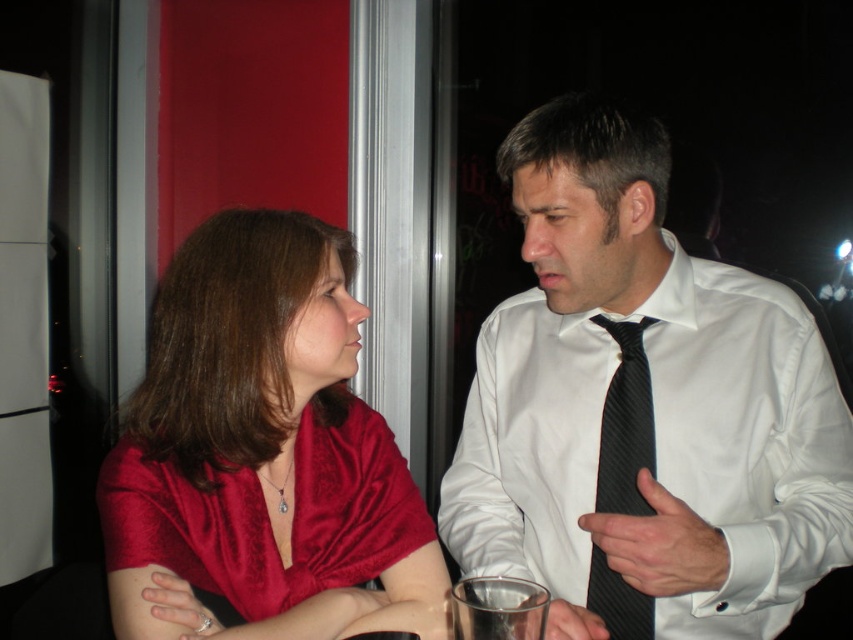
Between point (666, 584) and point (258, 298), which one is positioned behind?

The point (258, 298) is behind.

Can you confirm if white satin shirt at center is positioned above satin red blouse at center?

Correct, white satin shirt at center is located above satin red blouse at center.

Is point (819, 563) positioned after point (383, 589)?

No, it is in front of (383, 589).

I want to click on white satin shirt at center, so click(642, 408).

Describe the element at coordinates (642, 408) in the screenshot. I see `white satin shirt at center` at that location.

Does white satin shirt at center have a lesser height compared to black striped tie at right?

Incorrect, white satin shirt at center's height does not fall short of black striped tie at right's.

Which is in front, point (756, 448) or point (639, 426)?

Positioned in front is point (756, 448).

Identify the location of white satin shirt at center. This screenshot has height=640, width=853. (642, 408).

Can you confirm if black striped tie at right is positioned to the left of clear glass at lower center?

In fact, black striped tie at right is to the right of clear glass at lower center.

Is point (631, 339) in front of point (502, 630)?

No.

At what (x,y) coordinates should I click in order to perform the action: click on black striped tie at right. Please return your answer as a coordinate pair (x, y). This screenshot has height=640, width=853. Looking at the image, I should click on (x=625, y=422).